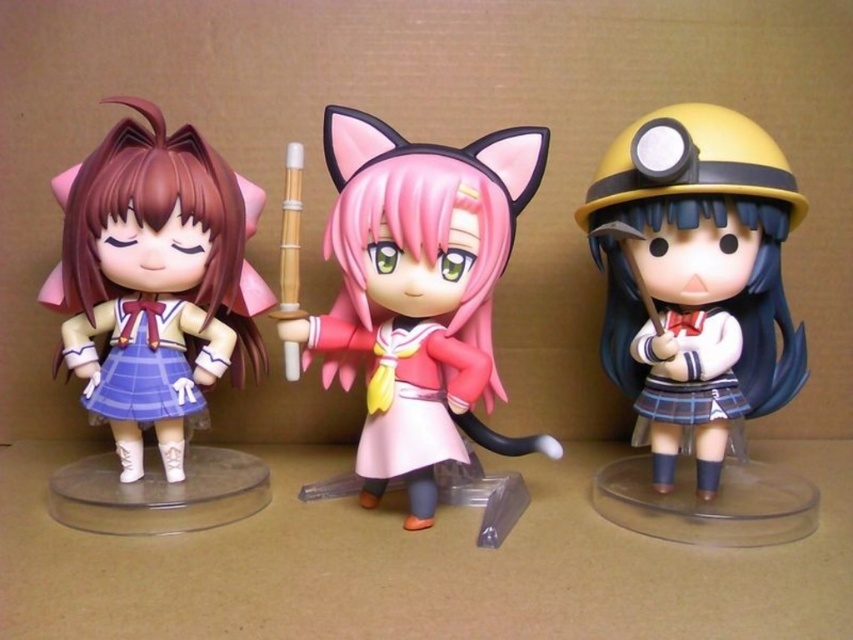
Question: Which of the following is the farthest from the observer?

Choices:
 (A) matte plastic doll at left
 (B) pink matte/silk cat ears at center

Answer: (A)

Question: Observing the image, what is the correct spatial positioning of matte yellow helmet at right in reference to matte plastic doll at left?

Choices:
 (A) left
 (B) right

Answer: (B)

Question: Does pink matte/silk cat ears at center have a greater width compared to matte plastic doll at left?

Choices:
 (A) yes
 (B) no

Answer: (A)

Question: Which point is closer to the camera taking this photo?

Choices:
 (A) (148, 236)
 (B) (375, 237)

Answer: (A)

Question: Which of the following is the farthest from the observer?

Choices:
 (A) pink matte/silk cat ears at center
 (B) matte yellow helmet at right

Answer: (A)

Question: Does matte yellow helmet at right have a lesser width compared to pink matte/silk cat ears at center?

Choices:
 (A) no
 (B) yes

Answer: (B)